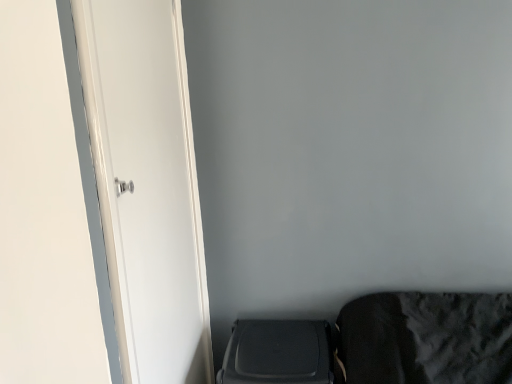
Question: Can you confirm if black matte suitcase at lower right is taller than white glossy door at left?

Choices:
 (A) yes
 (B) no

Answer: (B)

Question: Does black matte suitcase at lower right have a lesser width compared to white glossy door at left?

Choices:
 (A) no
 (B) yes

Answer: (A)

Question: Considering the relative sizes of black matte suitcase at lower right and white glossy door at left in the image provided, is black matte suitcase at lower right shorter than white glossy door at left?

Choices:
 (A) no
 (B) yes

Answer: (B)

Question: Is the depth of black matte suitcase at lower right greater than that of white glossy door at left?

Choices:
 (A) no
 (B) yes

Answer: (B)

Question: From the image's perspective, is black matte suitcase at lower right over white glossy door at left?

Choices:
 (A) no
 (B) yes

Answer: (A)

Question: Is black matte suitcase at lower right not near white glossy door at left?

Choices:
 (A) yes
 (B) no

Answer: (B)

Question: From a real-world perspective, is white glossy door at left positioned over black matte suitcase at lower right based on gravity?

Choices:
 (A) no
 (B) yes

Answer: (B)

Question: Can you see white glossy door at left touching black matte suitcase at lower right?

Choices:
 (A) yes
 (B) no

Answer: (B)

Question: From the image's perspective, is white glossy door at left below black matte suitcase at lower right?

Choices:
 (A) yes
 (B) no

Answer: (B)

Question: Does white glossy door at left have a smaller size compared to black matte suitcase at lower right?

Choices:
 (A) no
 (B) yes

Answer: (B)

Question: Can you confirm if white glossy door at left is positioned to the left of black matte suitcase at lower right?

Choices:
 (A) no
 (B) yes

Answer: (B)

Question: From a real-world perspective, is white glossy door at left below black matte suitcase at lower right?

Choices:
 (A) yes
 (B) no

Answer: (B)

Question: Considering the positions of black matte suitcase at lower right and white glossy door at left in the image, is black matte suitcase at lower right taller or shorter than white glossy door at left?

Choices:
 (A) short
 (B) tall

Answer: (A)